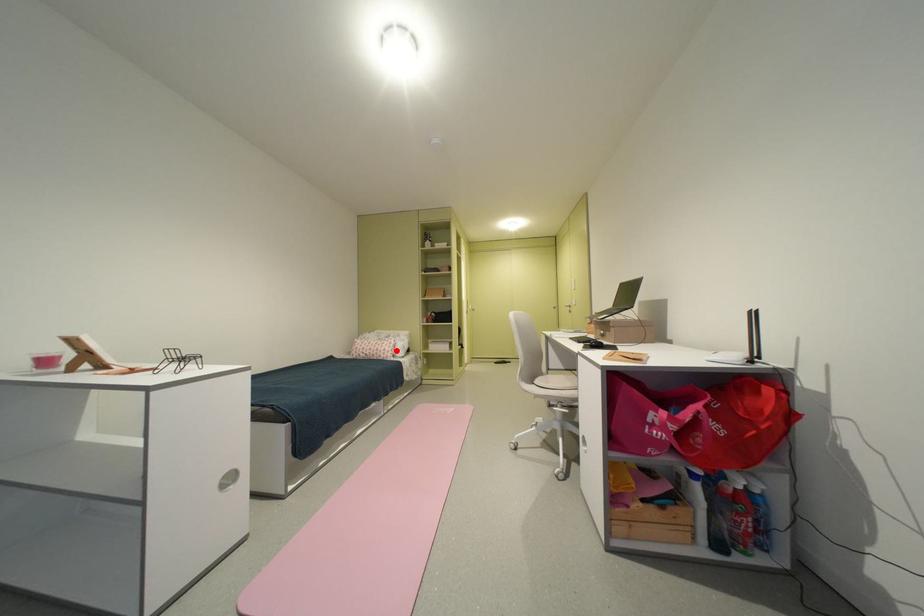
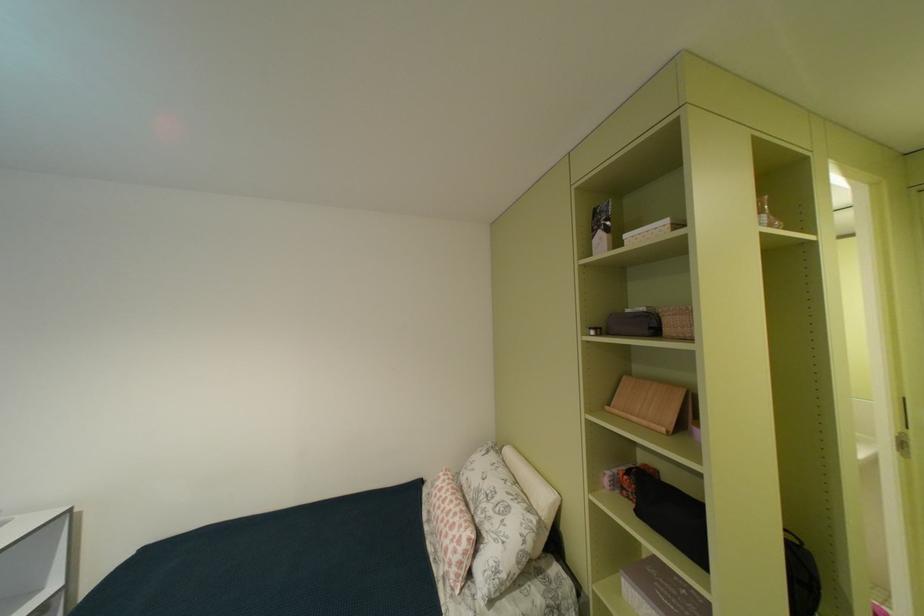
In the second image, find the point that corresponds to the highlighted location in the first image.

(458, 556)